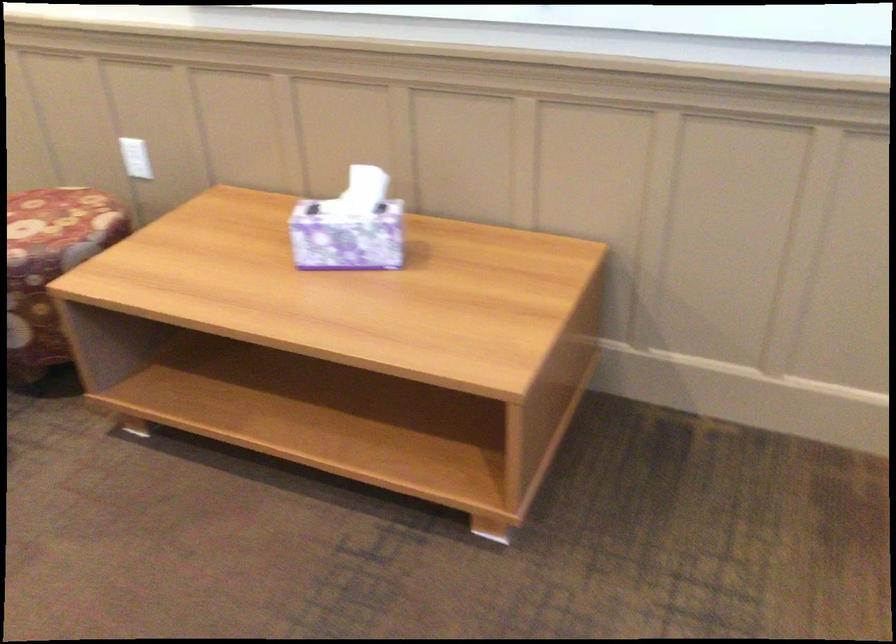
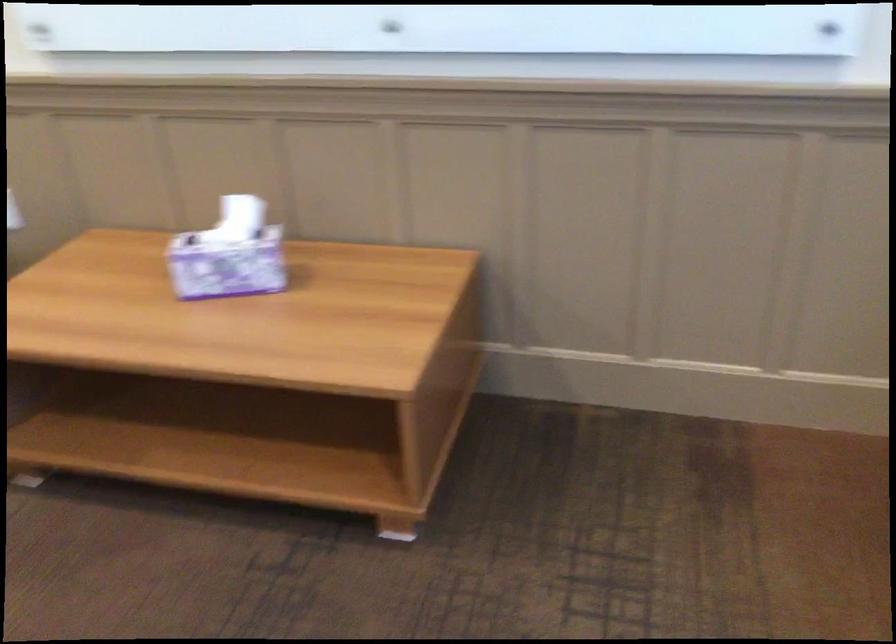
Question: In a continuous first-person perspective shot, in which direction is the camera moving?

Choices:
 (A) Left
 (B) Right
 (C) Forward
 (D) Backward

Answer: (D)